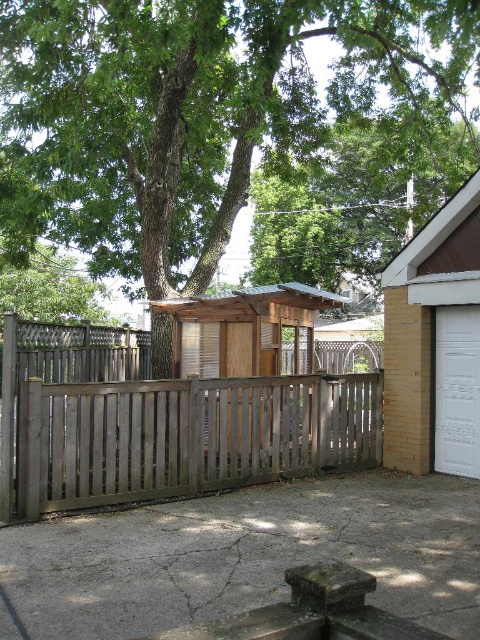
You are planning to install a new fence panel that is 1.2 meters wide. You have two options to place it either next to the weathered wood fence at center or next to the white glossy garage door at right. Based on their widths, which existing structure can accommodate the new panel without exceeding its width?

The weathered wood fence at center has a larger width than the white glossy garage door at right according to the description. Since the new panel is 1.2 meters wide, it would fit better next to the weathered wood fence at center which has more space available.

You are standing in the backyard and want to take a photo of both the green leafy tree at upper center and the wooden shed at center. Which object should you focus on first to ensure both are in focus?

You should focus on the green leafy tree at upper center first because it is closer to you than the wooden shed at center, so adjusting focus from near to far will help both be in focus.